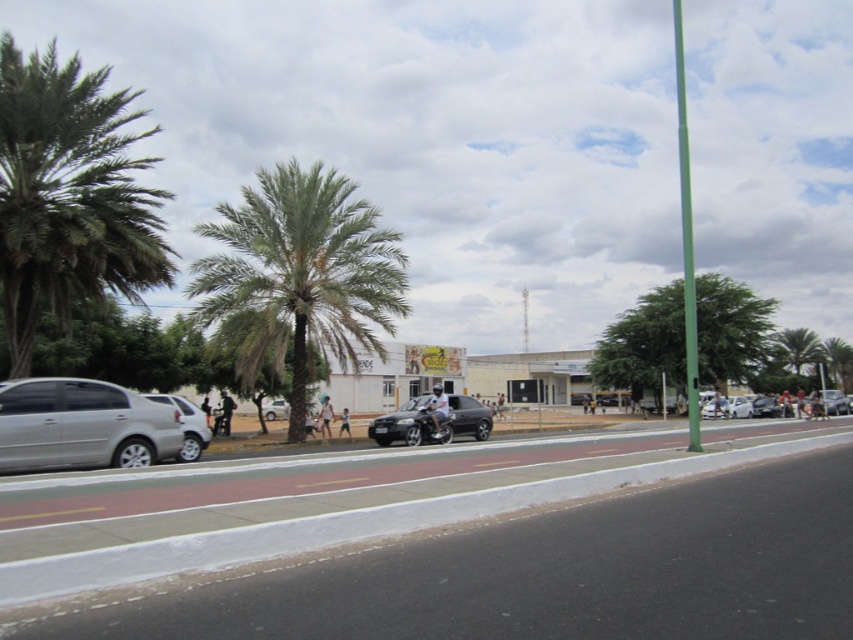
You are a pedestrian standing on the white pedestrian crossing area. You want to walk to the green pole on the right side of the image. Which object, the green leafy palm tree at center or the silver metallic car at lower left, will you pass by first?

The green leafy palm tree at center is positioned on the left side of the silver metallic car at lower left, so you will pass by the green leafy palm tree at center first on your way to the green pole on the right side of the image.

Looking at this image, you are a delivery person trying to navigate through the street scene. You need to know which object, the green leafy palm tree at center or the silver metallic car at lower left, is bigger in size to plan your route. Can you tell me which one is larger?

The green leafy palm tree at center is larger in size than the silver metallic car at lower left, so the palm tree is bigger.